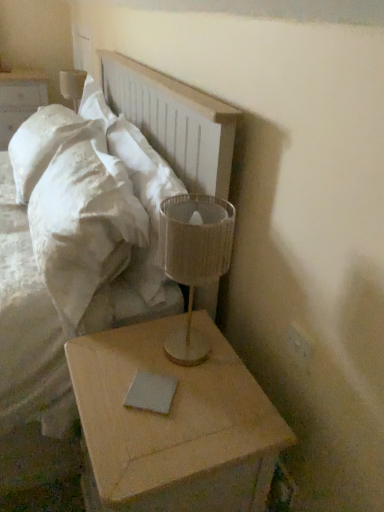
Where is `free spot to the left of translucent fabric lampshade at right, positioned as the 2th table lamp in top-to-bottom order`? The image size is (384, 512). free spot to the left of translucent fabric lampshade at right, positioned as the 2th table lamp in top-to-bottom order is located at coordinates (118, 362).